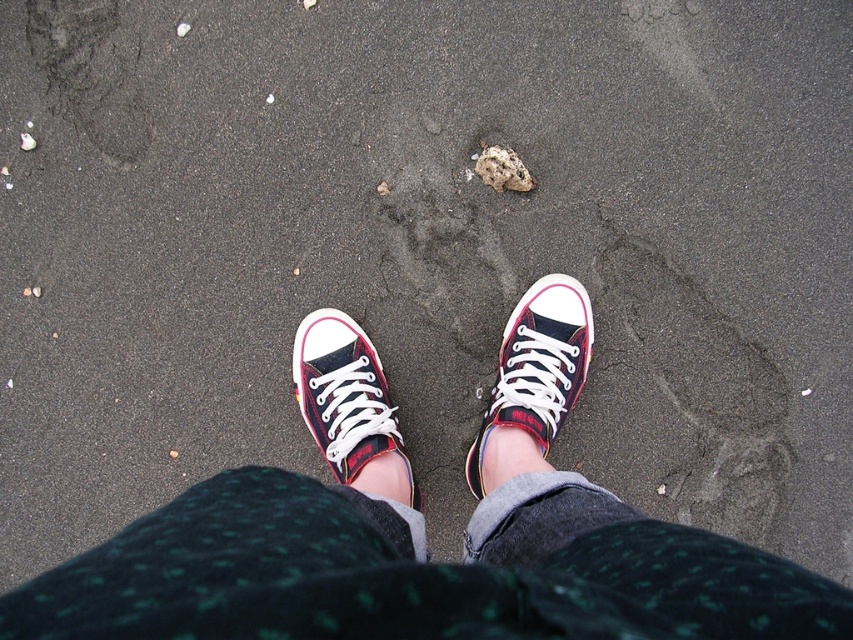
You are designing a shoe display stand and need to place both the matte canvas sneakers at center and the plaid canvas shoe at center side by side. Given their sizes, which one should you allocate more space for?

The matte canvas sneakers at center is bigger than the plaid canvas shoe at center, so you should allocate more space for the matte canvas sneakers at center.

You are designing a shoe display stand that needs to accommodate both the plaid canvas shoe at center and the matte canvas sneaker at center. Given their widths, which shoe requires a wider space on the stand?

The matte canvas sneaker at center requires a wider space on the stand because it has a greater width than the plaid canvas shoe at center.